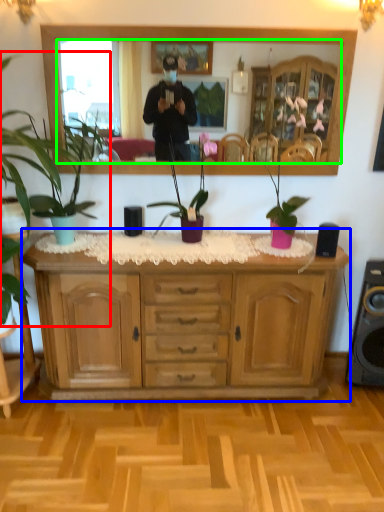
Question: Considering the real-world distances, which object is closest to houseplant (highlighted by a red box)? cabinetry (highlighted by a blue box) or mirror (highlighted by a green box).

Choices:
 (A) cabinetry
 (B) mirror

Answer: (A)